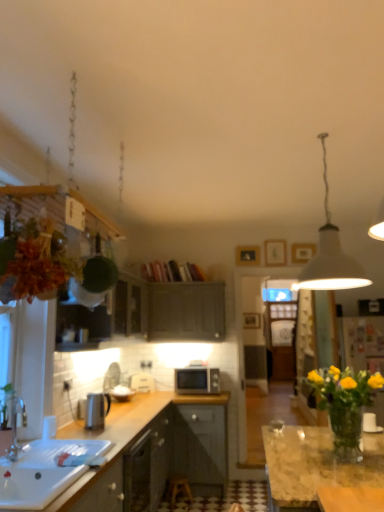
Question: Does point (167, 487) appear closer or farther from the camera than point (92, 394)?

Choices:
 (A) farther
 (B) closer

Answer: (A)

Question: Would you say wooden stool at center is to the left or to the right of metallic silver kettle at left in the picture?

Choices:
 (A) left
 (B) right

Answer: (B)

Question: Estimate the real-world distances between objects in this image. Which object is farther from the green matte cabinet at upper left, the 2th cabinetry when ordered from right to left?

Choices:
 (A) matte black microwave at center
 (B) wooden stool at center
 (C) metallic silver kettle at left
 (D) leather-like brown plant hanger at upper left
 (E) white glossy sink at lower left

Answer: (D)

Question: Which is farther from the green matte cabinet at upper left, which is the second cabinetry in back-to-front order?

Choices:
 (A) wooden stool at center
 (B) brushed metal faucet at left
 (C) white matte pendant lamp at upper right
 (D) matte gray cabinet at center, positioned as the first cabinetry in right-to-left order
 (E) translucent glass vase at center right

Answer: (E)